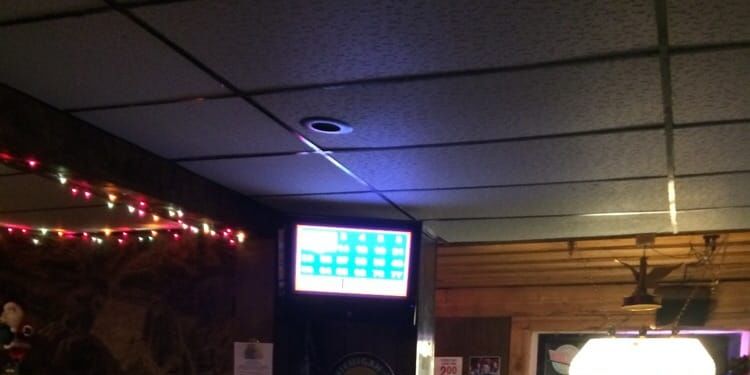
The image size is (750, 375). I want to click on figure of father christmas, so click(x=25, y=321).